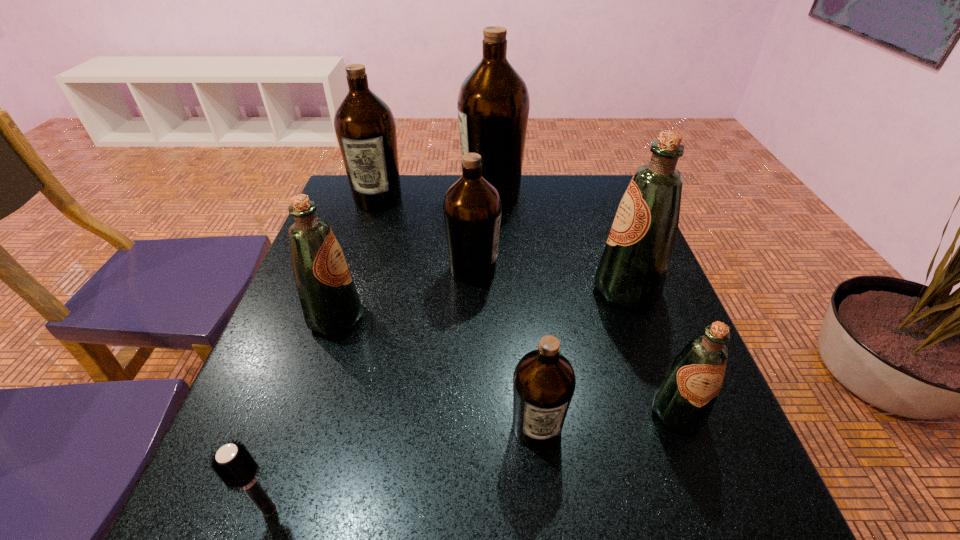
Locate an element on the screen. Image resolution: width=960 pixels, height=540 pixels. vacant area between the leftmost green olive oil and the shortest object is located at coordinates (302, 414).

Locate which object is the fifth closest to the shortest object. Please provide its 2D coordinates. Your answer should be formatted as a tuple, i.e. [(x, y)], where the tuple contains the x and y coordinates of a point satisfying the conditions above.

[(632, 271)]

Identify which object is the nearest to the nearest brown olive oil. Please provide its 2D coordinates. Your answer should be formatted as a tuple, i.e. [(x, y)], where the tuple contains the x and y coordinates of a point satisfying the conditions above.

[(683, 400)]

Locate which olive oil ranks in proximity to the second smallest green olive oil. Please provide its 2D coordinates. Your answer should be formatted as a tuple, i.e. [(x, y)], where the tuple contains the x and y coordinates of a point satisfying the conditions above.

[(472, 207)]

This screenshot has height=540, width=960. I want to click on olive oil that is the fourth closest to the third farthest brown olive oil, so click(365, 127).

The width and height of the screenshot is (960, 540). Find the location of `the second closest brown olive oil to the leftmost green olive oil`. the second closest brown olive oil to the leftmost green olive oil is located at coordinates (544, 382).

Find the location of a particular element. brown olive oil that stands as the fourth closest to the hairbrush is located at coordinates (493, 104).

Select which green olive oil appears as the second closest to the smallest brown olive oil. Please provide its 2D coordinates. Your answer should be formatted as a tuple, i.e. [(x, y)], where the tuple contains the x and y coordinates of a point satisfying the conditions above.

[(632, 271)]

Choose which green olive oil is the second nearest neighbor to the leftmost green olive oil. Please provide its 2D coordinates. Your answer should be formatted as a tuple, i.e. [(x, y)], where the tuple contains the x and y coordinates of a point satisfying the conditions above.

[(683, 400)]